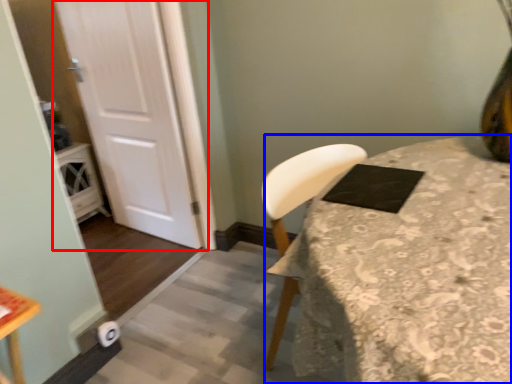
Question: Which object appears farthest to the camera in this image, door (highlighted by a red box) or table (highlighted by a blue box)?

Choices:
 (A) door
 (B) table

Answer: (A)